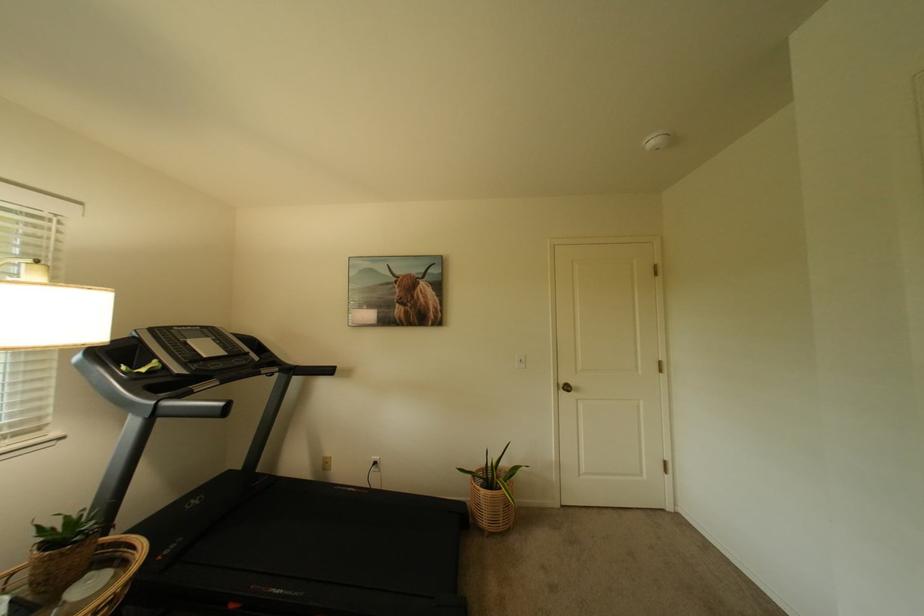
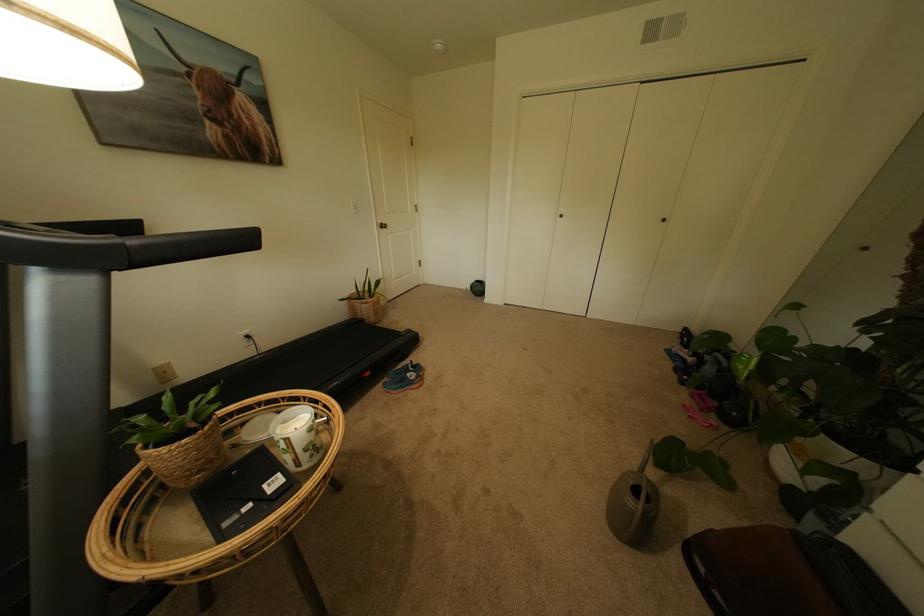
Locate, in the second image, the point that corresponds to (577,392) in the first image.

(394, 229)